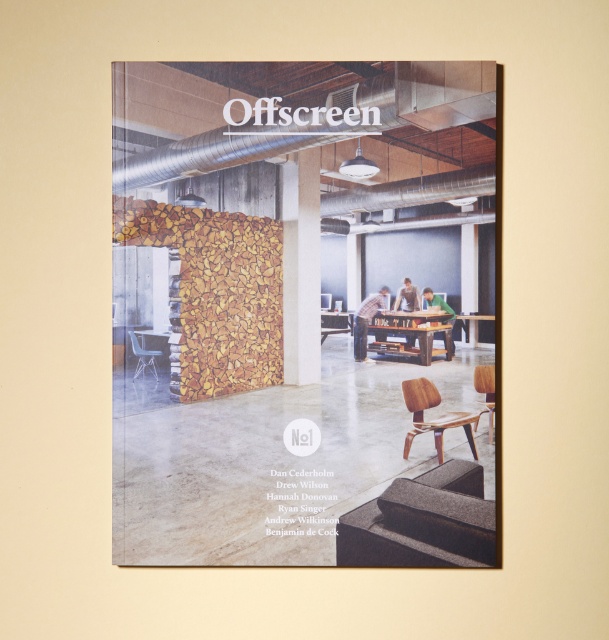
Between wooden chair at right and matte black chair at lower left, which one appears on the left side from the viewer's perspective?

Positioned to the left is matte black chair at lower left.

Locate an element on the screen. Image resolution: width=609 pixels, height=640 pixels. wooden chair at right is located at coordinates (485, 390).

Identify the location of wooden chair at right. This screenshot has width=609, height=640. (485, 390).

Does matte wood poster at center appear under matte black chair at lower left?

Incorrect, matte wood poster at center is not positioned below matte black chair at lower left.

How much distance is there between matte wood poster at center and matte black chair at lower left?

matte wood poster at center and matte black chair at lower left are 18.96 inches apart.

Where is `matte wood poster at center`? Image resolution: width=609 pixels, height=640 pixels. matte wood poster at center is located at coordinates tap(297, 312).

Who is higher up, matte wood poster at center or wooden chair at lower right?

Positioned higher is matte wood poster at center.

Between point (385, 109) and point (406, 456), which one is positioned in front?

Point (385, 109) is in front.

Is point (127, 282) positioned in front of point (443, 413)?

Yes.

Where is `matte wood poster at center`? This screenshot has height=640, width=609. matte wood poster at center is located at coordinates (297, 312).